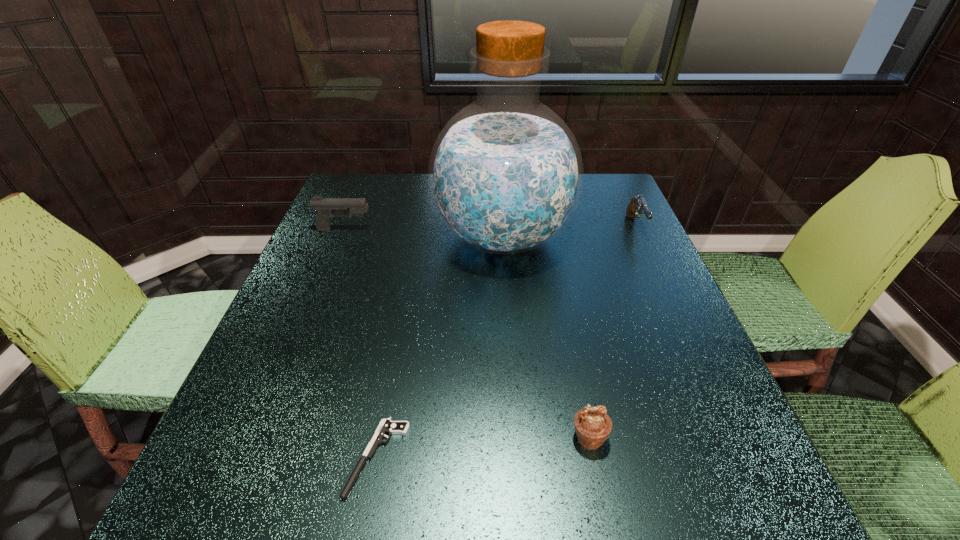
Identify the location of free point located on the front-facing side of the shortest object. The image size is (960, 540). (237, 457).

What are the coordinates of `free space located 0.210m on the front-facing side of the shortest object` in the screenshot? It's located at coord(219,457).

The width and height of the screenshot is (960, 540). Identify the location of free point located on the front-facing side of the shortest object. pos(262,457).

Where is `water jug that is at the far edge`? Image resolution: width=960 pixels, height=540 pixels. water jug that is at the far edge is located at coordinates (505, 176).

This screenshot has width=960, height=540. Find the location of `pistol located in the far edge section of the desktop`. pistol located in the far edge section of the desktop is located at coordinates (638, 204).

Find the location of a particular element. This screenshot has height=540, width=960. object situated at the near edge is located at coordinates (387, 426).

Locate an element on the screen. object that is at the left edge is located at coordinates (326, 207).

Find the location of a particular element. The width and height of the screenshot is (960, 540). object present at the right edge is located at coordinates (638, 204).

The image size is (960, 540). What are the coordinates of `object present at the far right corner` in the screenshot? It's located at (638, 204).

In the image, there is a desktop. Identify the location of vacant area at the near edge. (340, 513).